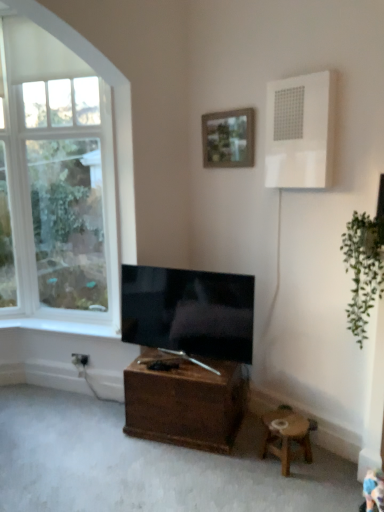
Question: Does white plastic air conditioner at upper right have a smaller size compared to brown wooden table at center?

Choices:
 (A) no
 (B) yes

Answer: (B)

Question: Can you confirm if white plastic air conditioner at upper right is thinner than brown wooden table at center?

Choices:
 (A) no
 (B) yes

Answer: (B)

Question: Is white plastic air conditioner at upper right positioned with its back to brown wooden table at center?

Choices:
 (A) no
 (B) yes

Answer: (A)

Question: Are white plastic air conditioner at upper right and brown wooden table at center located far from each other?

Choices:
 (A) yes
 (B) no

Answer: (A)

Question: From a real-world perspective, is white plastic air conditioner at upper right below brown wooden table at center?

Choices:
 (A) no
 (B) yes

Answer: (A)

Question: From a real-world perspective, does white plastic air conditioner at upper right stand above brown wooden table at center?

Choices:
 (A) no
 (B) yes

Answer: (B)

Question: Does wooden framed picture at upper center turn towards matte black tv at center?

Choices:
 (A) no
 (B) yes

Answer: (A)

Question: Is wooden framed picture at upper center to the left of matte black tv at center from the viewer's perspective?

Choices:
 (A) yes
 (B) no

Answer: (B)

Question: Does wooden framed picture at upper center have a larger size compared to matte black tv at center?

Choices:
 (A) yes
 (B) no

Answer: (B)

Question: From the image's perspective, is wooden framed picture at upper center over matte black tv at center?

Choices:
 (A) no
 (B) yes

Answer: (B)

Question: Is wooden framed picture at upper center taller than matte black tv at center?

Choices:
 (A) no
 (B) yes

Answer: (A)

Question: Can matte black tv at center be found inside wooden framed picture at upper center?

Choices:
 (A) no
 (B) yes

Answer: (A)

Question: Does white glass window at upper left have a greater height compared to white plastic air conditioner at upper right?

Choices:
 (A) no
 (B) yes

Answer: (B)